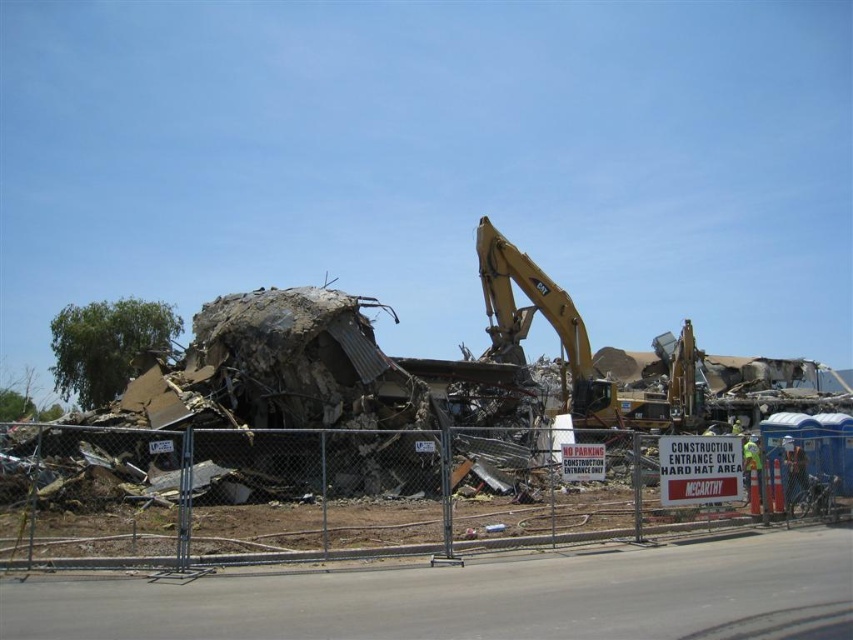
You are standing at the chain link fence in the demolition site. You see a point at coordinates point [80,484]. Can you safely walk to that point without getting too close to the excavator?

The point at [80,484] is 38.91 meters away from you, so yes, you can safely walk to that point without getting too close to the excavator.